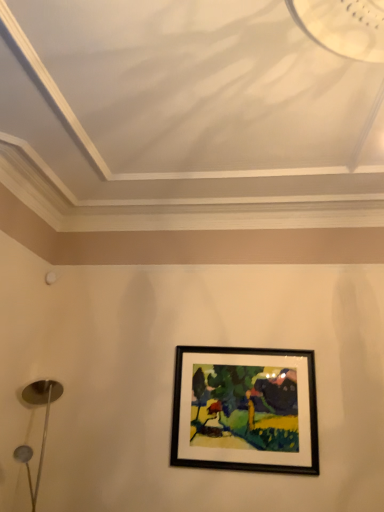
Locate an element on the screen. black matte picture frame at center is located at coordinates (245, 410).

The height and width of the screenshot is (512, 384). What do you see at coordinates (245, 410) in the screenshot? I see `black matte picture frame at center` at bounding box center [245, 410].

Locate an element on the screen. The image size is (384, 512). black matte picture frame at center is located at coordinates (245, 410).